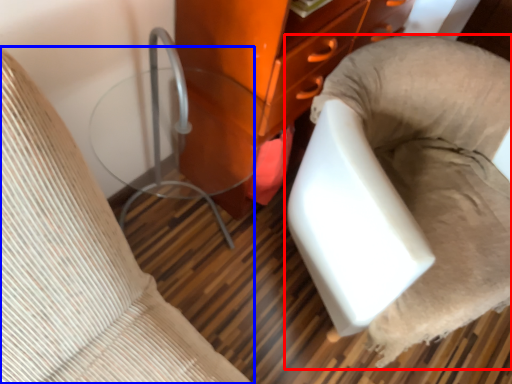
Question: Which of the following is the farthest to the observer, furniture (highlighted by a red box) or furniture (highlighted by a blue box)?

Choices:
 (A) furniture
 (B) furniture

Answer: (A)